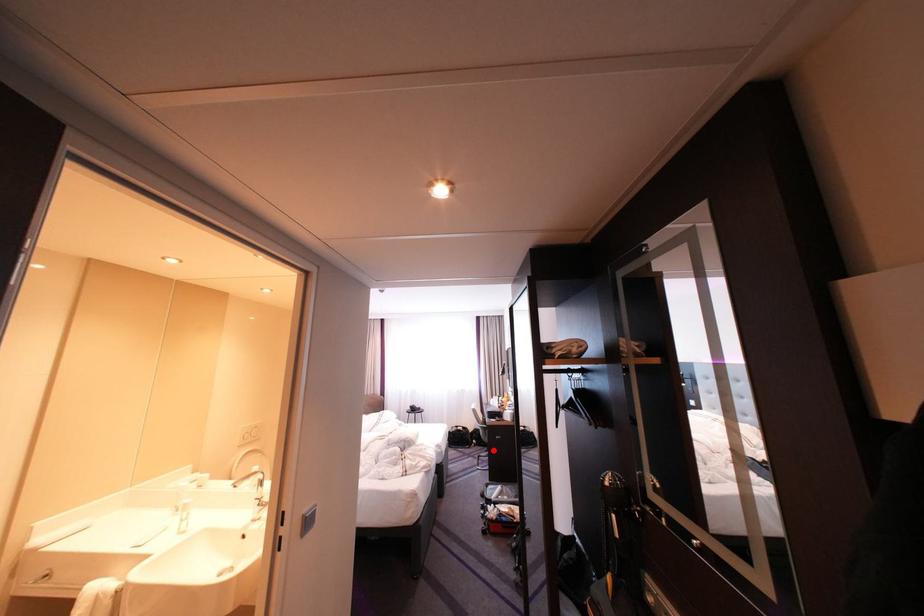
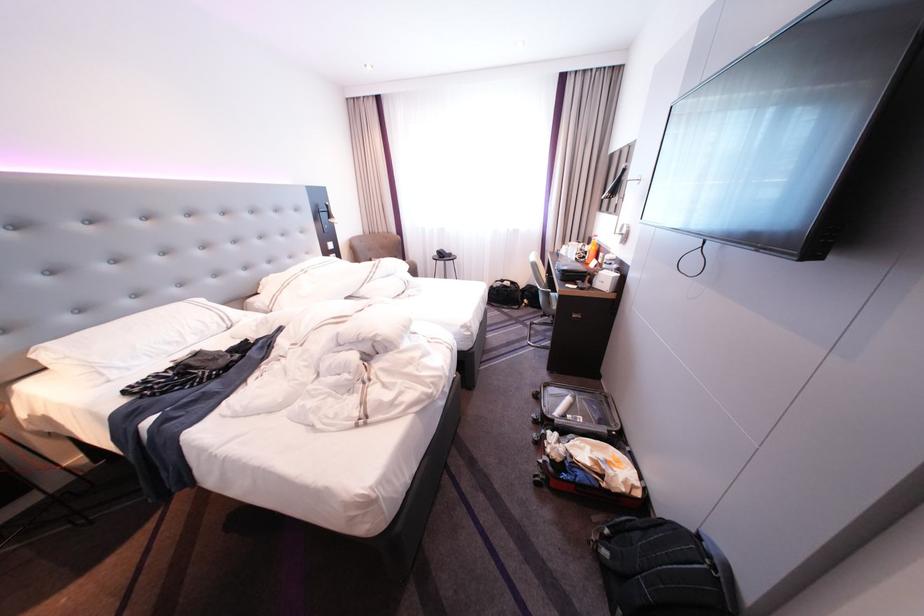
Question: I am providing you with two images of the same scene from different viewpoints. In image1, a red point is highlighted. Considering the same 3D point in image2, which of the following is correct?

Choices:
 (A) It is closer
 (B) It is farther

Answer: (A)